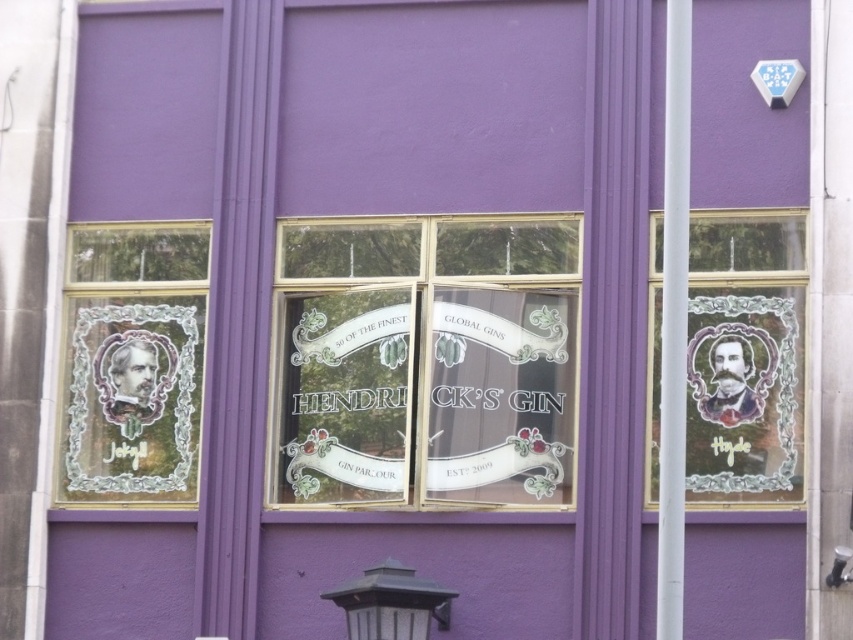
You are a delivery person who needs to place a small package on the building facade. The package must be placed exactly at point (x=132, y=364). However, there is an object already present at that location. What object is at that point?

The point (x=132, y=364) is occupied by the matte glass portrait at left.

You are standing in front of the building facade and want to touch both points labeled as point (80, 413) and point (660, 218). Which point will you reach first?

You will reach point (80, 413) first because it is closer to you than point (660, 218), which is further away.